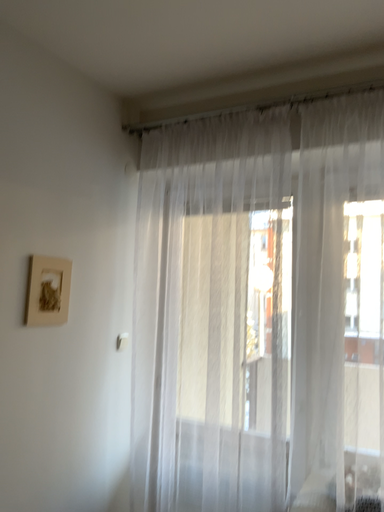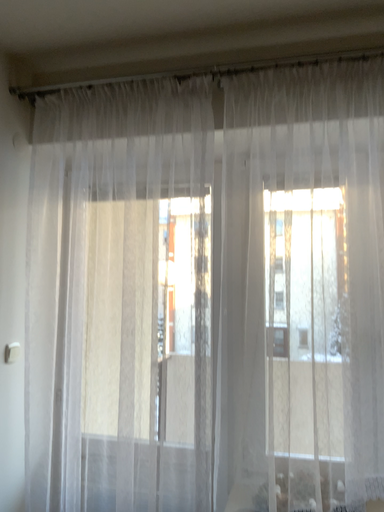
Question: Which way did the camera rotate in the video?

Choices:
 (A) rotated right
 (B) rotated left

Answer: (A)